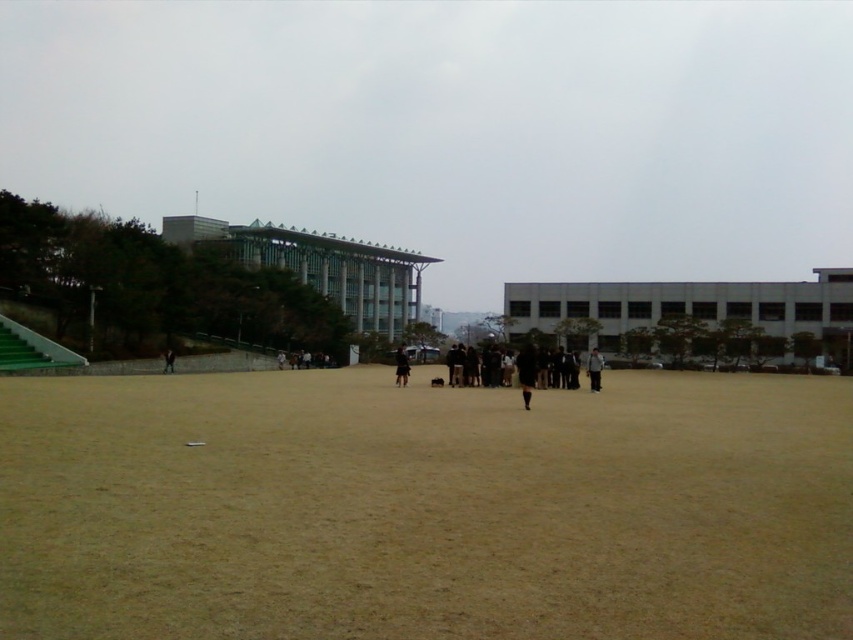
Does point (518, 381) lie in front of point (170, 353)?

Yes, it is.

Who is taller, dark brown leather jacket at center or matte black person at center?

dark brown leather jacket at center

Find the location of a particular element. Image resolution: width=853 pixels, height=640 pixels. dark brown leather jacket at center is located at coordinates (526, 371).

Is black fabric person at center below black matte jacket at center?

No, black fabric person at center is not below black matte jacket at center.

Which of these two, black fabric person at center or black matte jacket at center, stands shorter?

Standing shorter between the two is black fabric person at center.

Between point (595, 378) and point (395, 380), which one is positioned behind?

The point (395, 380) is more distant.

You are a GUI agent. You are given a task and a screenshot of the screen. Output one action in this format:
    pyautogui.click(x=<x>, y=<y>)
    Task: Click on the black fabric person at center
    
    Given the screenshot: What is the action you would take?
    pyautogui.click(x=595, y=369)

Does dark brown leather jacket at center have a lesser width compared to black matte jacket at center?

Incorrect, dark brown leather jacket at center's width is not less than black matte jacket at center's.

Who is shorter, dark brown leather jacket at center or black matte jacket at center?

black matte jacket at center

Between point (521, 365) and point (405, 372), which one is positioned behind?

The point (405, 372) is behind.

What are the coordinates of `dark brown leather jacket at center` in the screenshot? It's located at (526, 371).